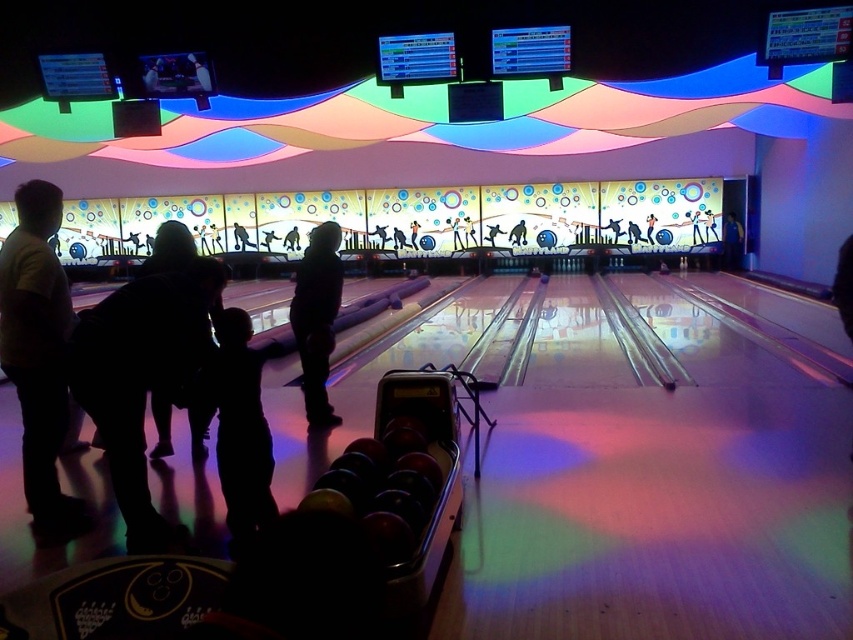
Question: Is dark clothing at left above silhouette/shadow child at center?

Choices:
 (A) yes
 (B) no

Answer: (A)

Question: Which point is farther to the camera?

Choices:
 (A) (200, 435)
 (B) (247, 420)
 (C) (316, 250)
 (D) (22, 243)

Answer: (C)

Question: Based on their relative distances, which object is nearer to the silhouette/shadow child at center?

Choices:
 (A) dark clothing at left
 (B) black matte bowling ball at left

Answer: (B)

Question: Which point is farther to the camera?

Choices:
 (A) dark clothing at left
 (B) black matte bowling ball at left

Answer: (A)

Question: Is the position of dark clothing at left more distant than that of black matte clothing at center?

Choices:
 (A) no
 (B) yes

Answer: (A)

Question: Does dark clothing at left have a greater width compared to black matte clothing at center?

Choices:
 (A) yes
 (B) no

Answer: (A)